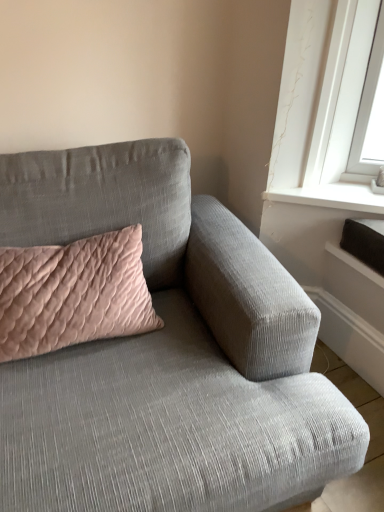
This screenshot has height=512, width=384. Describe the element at coordinates (73, 294) in the screenshot. I see `pink quilted cushion at upper left` at that location.

Identify the location of pink quilted cushion at upper left. (73, 294).

What do you see at coordinates (165, 426) in the screenshot? The width and height of the screenshot is (384, 512). I see `textured gray couch at center` at bounding box center [165, 426].

Where is `textured gray couch at center`? This screenshot has height=512, width=384. textured gray couch at center is located at coordinates (165, 426).

Locate an element on the screen. This screenshot has height=512, width=384. pink quilted cushion at upper left is located at coordinates (73, 294).

Based on the photo, is pink quilted cushion at upper left at the right side of textured gray couch at center?

In fact, pink quilted cushion at upper left is to the left of textured gray couch at center.

Which is behind, pink quilted cushion at upper left or textured gray couch at center?

pink quilted cushion at upper left is behind.

Which is more distant, (137, 255) or (301, 426)?

Positioned behind is point (137, 255).

From the image's perspective, between pink quilted cushion at upper left and textured gray couch at center, which one is located above?

pink quilted cushion at upper left is shown above in the image.

From a real-world perspective, does pink quilted cushion at upper left stand above textured gray couch at center?

Correct, in the physical world, pink quilted cushion at upper left is higher than textured gray couch at center.

Considering the sizes of objects pink quilted cushion at upper left and textured gray couch at center in the image provided, who is wider, pink quilted cushion at upper left or textured gray couch at center?

textured gray couch at center.

Who is shorter, pink quilted cushion at upper left or textured gray couch at center?

Standing shorter between the two is pink quilted cushion at upper left.

Can you confirm if pink quilted cushion at upper left is smaller than textured gray couch at center?

Indeed, pink quilted cushion at upper left has a smaller size compared to textured gray couch at center.

Is pink quilted cushion at upper left positioned beyond the bounds of textured gray couch at center?

That's incorrect, pink quilted cushion at upper left is not completely outside textured gray couch at center.

Is pink quilted cushion at upper left next to textured gray couch at center?

There is a gap between pink quilted cushion at upper left and textured gray couch at center.

Does pink quilted cushion at upper left turn towards textured gray couch at center?

Yes, pink quilted cushion at upper left faces towards textured gray couch at center.

Locate an element on the screen. studio couch on the right of pink quilted cushion at upper left is located at coordinates (165, 426).

Is textured gray couch at center at the right side of pink quilted cushion at upper left?

Yes.

Relative to pink quilted cushion at upper left, is textured gray couch at center in front or behind?

Visually, textured gray couch at center is located in front of pink quilted cushion at upper left.

Which is closer to the camera, [134,357] or [46,278]?

Point [134,357]

From the image's perspective, which object appears higher, textured gray couch at center or pink quilted cushion at upper left?

From the image's view, pink quilted cushion at upper left is above.

From a real-world perspective, is textured gray couch at center positioned above or below pink quilted cushion at upper left?

Clearly, from a real-world perspective, textured gray couch at center is below pink quilted cushion at upper left.

Considering the relative sizes of textured gray couch at center and pink quilted cushion at upper left in the image provided, is textured gray couch at center wider than pink quilted cushion at upper left?

Indeed, textured gray couch at center has a greater width compared to pink quilted cushion at upper left.

Between textured gray couch at center and pink quilted cushion at upper left, which one has less height?

Standing shorter between the two is pink quilted cushion at upper left.

Is textured gray couch at center bigger than pink quilted cushion at upper left?

Yes.

Is textured gray couch at center surrounding pink quilted cushion at upper left?

Absolutely, pink quilted cushion at upper left is inside textured gray couch at center.

Is textured gray couch at center not close to pink quilted cushion at upper left?

Actually, textured gray couch at center and pink quilted cushion at upper left are a little close together.

Is textured gray couch at center looking in the opposite direction of pink quilted cushion at upper left?

Yes, textured gray couch at center is facing away from pink quilted cushion at upper left.

How far apart are textured gray couch at center and pink quilted cushion at upper left?

textured gray couch at center is 6.91 inches from pink quilted cushion at upper left.

What are the coordinates of `pillow that is above the textured gray couch at center (from the image's perspective)` in the screenshot? It's located at (73, 294).

At what (x,y) coordinates should I click in order to perform the action: click on studio couch located on the right of pink quilted cushion at upper left. Please return your answer as a coordinate pair (x, y). Looking at the image, I should click on (165, 426).

I want to click on pillow located on the left of textured gray couch at center, so click(x=73, y=294).